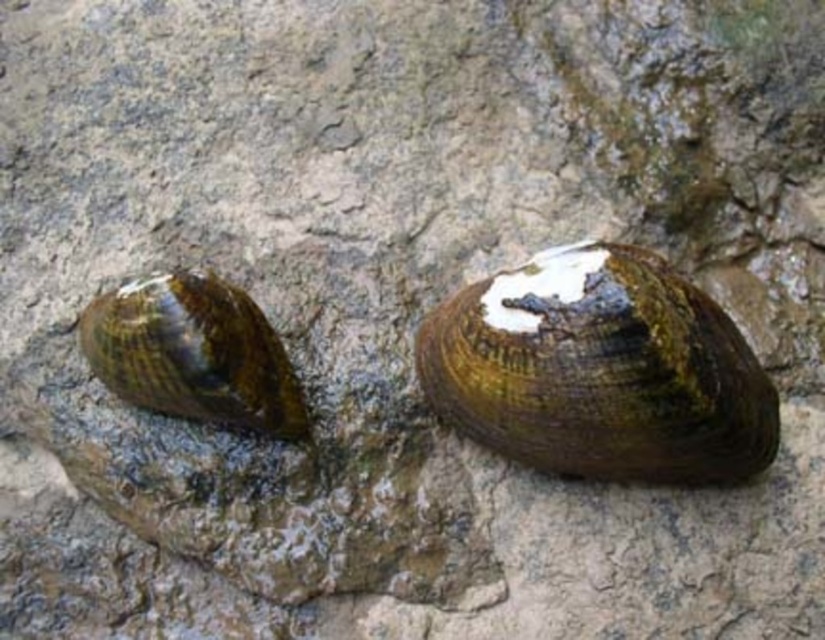
You are a researcher studying freshwater mussels. You observe a shiny brown shell at center located at point (600, 371). Can you confirm if this point is the exact center of the rock surface?

The shiny brown shell at center is located at point (600, 371), which is the exact center of the rock surface.

In the scene shown: You are a biologist measuring the distance between two mussels for a study. The minimum required distance for their survival is 12 inches. Are the shiny brown shell at center and the shiny brown shell at left spaced appropriately according to the requirement?

The shiny brown shell at center and the shiny brown shell at left are 11.66 inches apart, which is less than the required 12 inches for their survival. Therefore, they are not spaced appropriately according to the requirement.